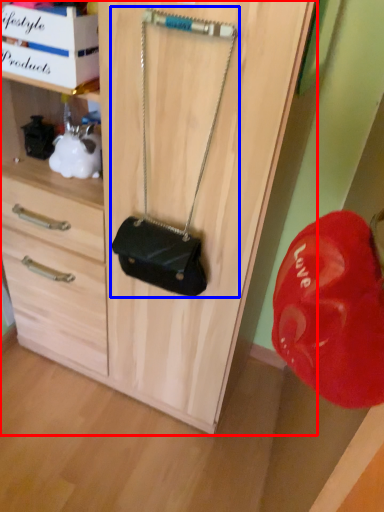
Question: Among these objects, which one is farthest to the camera, cabinetry (highlighted by a red box) or handbag (highlighted by a blue box)?

Choices:
 (A) cabinetry
 (B) handbag

Answer: (A)